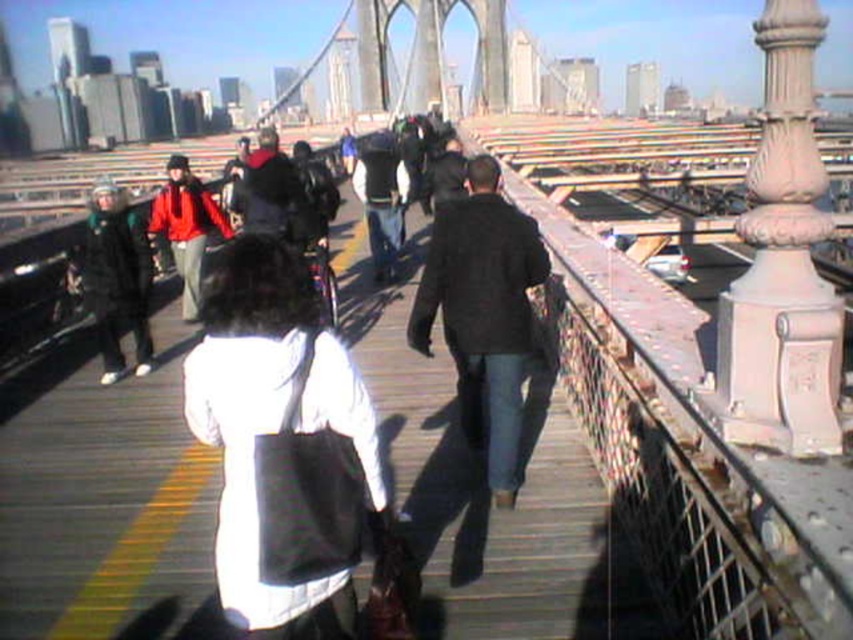
Question: Can you confirm if wooden bridge at center is positioned to the left of matte red jacket at center?

Choices:
 (A) no
 (B) yes

Answer: (A)

Question: Which point is farther to the camera?

Choices:
 (A) (360, 444)
 (B) (76, 339)

Answer: (B)

Question: Which object is closer to the camera taking this photo?

Choices:
 (A) wooden bridge at center
 (B) black matte jacket at left
 (C) black matte jacket at center

Answer: (A)

Question: Is white matte bag at center smaller than black matte jacket at left?

Choices:
 (A) no
 (B) yes

Answer: (A)

Question: Which point is farther to the camera?

Choices:
 (A) (511, 410)
 (B) (138, 340)
 (C) (166, 230)

Answer: (C)

Question: Is wooden bridge at center bigger than white matte bag at center?

Choices:
 (A) no
 (B) yes

Answer: (B)